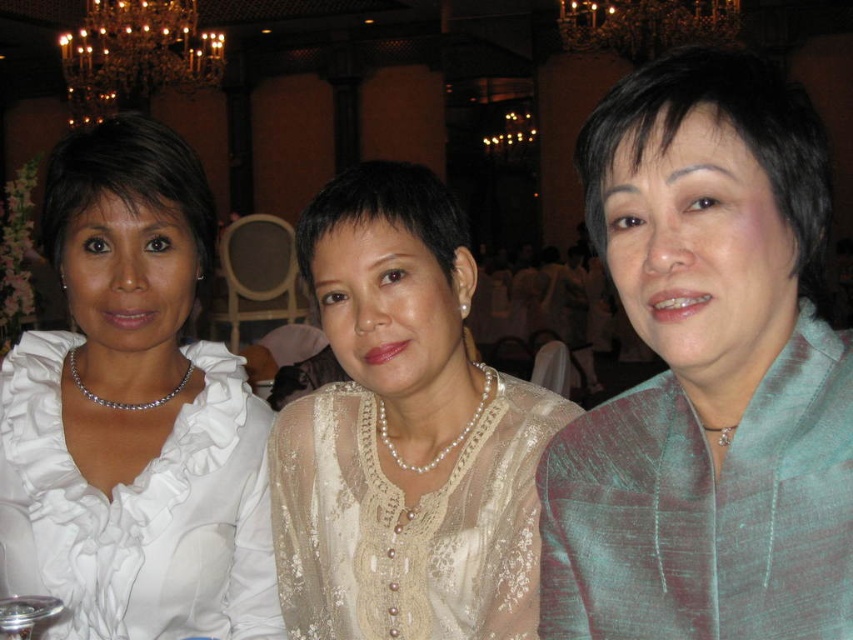
Question: Does teal silk jacket at center lie in front of pearl lace blouse at center?

Choices:
 (A) yes
 (B) no

Answer: (A)

Question: Is teal silk jacket at center thinner than white satin blouse at left?

Choices:
 (A) no
 (B) yes

Answer: (B)

Question: Estimate the real-world distances between objects in this image. Which object is farther from the white satin blouse at left?

Choices:
 (A) pearl lace blouse at center
 (B) teal silk jacket at center

Answer: (B)

Question: Which of the following is the closest to the observer?

Choices:
 (A) (321, 445)
 (B) (51, 218)
 (C) (705, 588)

Answer: (C)

Question: Which object is positioned closest to the pearl lace blouse at center?

Choices:
 (A) white satin blouse at left
 (B) teal silk jacket at center

Answer: (A)

Question: Can you confirm if teal silk jacket at center is positioned to the right of white satin blouse at left?

Choices:
 (A) yes
 (B) no

Answer: (A)